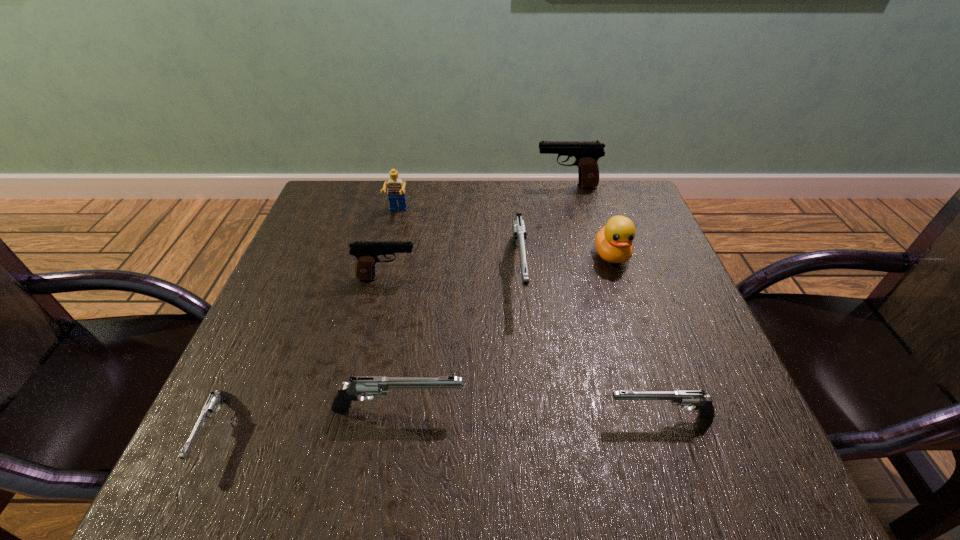
Find the location of a particular element. This screenshot has width=960, height=540. the right black pistol is located at coordinates (586, 153).

The height and width of the screenshot is (540, 960). What are the coordinates of `the tallest pistol` in the screenshot? It's located at (586, 153).

At what (x,y) coordinates should I click in order to perform the action: click on blue Lego. Please return your answer as a coordinate pair (x, y). This screenshot has width=960, height=540. Looking at the image, I should click on (396, 191).

Where is `the second farthest object`? This screenshot has height=540, width=960. the second farthest object is located at coordinates (396, 191).

The width and height of the screenshot is (960, 540). Find the location of `duckling`. duckling is located at coordinates (613, 242).

You are a GUI agent. You are given a task and a screenshot of the screen. Output one action in this format:
    pyautogui.click(x=<x>, y=<y>)
    Task: Click on the fifth object from left to right
    
    Given the screenshot: What is the action you would take?
    pyautogui.click(x=519, y=231)

Where is `the fourth pistol from left to right`? The width and height of the screenshot is (960, 540). the fourth pistol from left to right is located at coordinates (519, 231).

Locate an element on the screen. the smaller black pistol is located at coordinates (367, 252).

This screenshot has height=540, width=960. I want to click on the nearer black pistol, so click(367, 252).

Locate an element on the screen. the sixth tallest object is located at coordinates (359, 385).